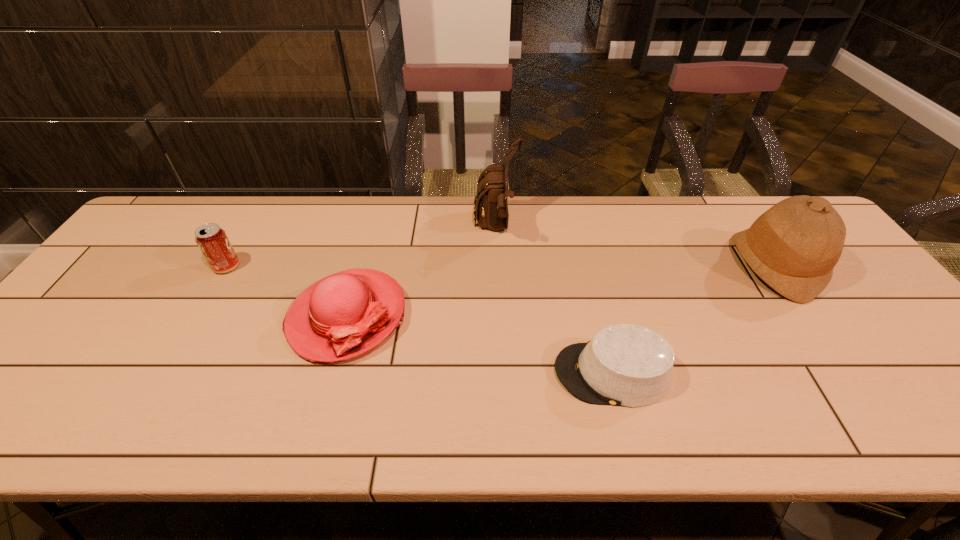
Where is `shoulder bag`? This screenshot has height=540, width=960. shoulder bag is located at coordinates (490, 205).

This screenshot has height=540, width=960. In order to click on the rightmost hat in this screenshot , I will do `click(793, 247)`.

Where is `the rightmost object`? The height and width of the screenshot is (540, 960). the rightmost object is located at coordinates (793, 247).

Find the location of a particular element. the leftmost object is located at coordinates (211, 239).

The width and height of the screenshot is (960, 540). I want to click on the fourth object from right to left, so click(344, 315).

Identify the location of the second tallest hat. (344, 315).

Find the location of `the fourth object from left to right`. the fourth object from left to right is located at coordinates (628, 365).

Identify the location of the second hat from left to right. (628, 365).

The height and width of the screenshot is (540, 960). I want to click on vacant space situated 0.160m on the front-facing side of the third object from left to right, so (421, 228).

What are the coordinates of `vacant space located 0.380m on the front-facing side of the third object from left to right` in the screenshot? It's located at (350, 228).